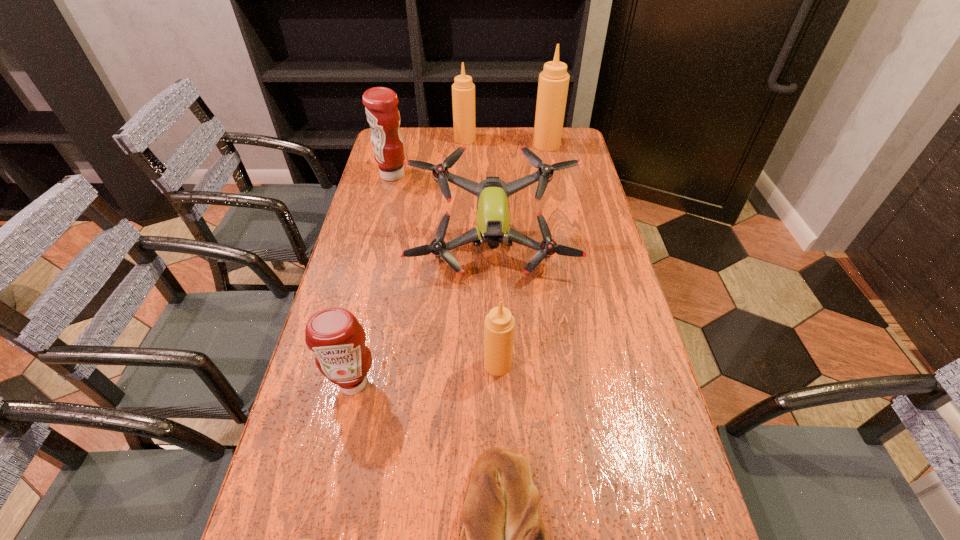
Where is `the tallest object`? the tallest object is located at coordinates (553, 83).

What are the coordinates of `the tallest condiment` in the screenshot? It's located at (553, 83).

At what (x,y) coordinates should I click in order to perform the action: click on the third condiment from left to right. Please return your answer as a coordinate pair (x, y). The height and width of the screenshot is (540, 960). Looking at the image, I should click on (463, 90).

The height and width of the screenshot is (540, 960). What are the coordinates of `the second biggest tan condiment` in the screenshot? It's located at (463, 90).

Locate an element on the screen. the sixth nearest object is located at coordinates (382, 113).

This screenshot has height=540, width=960. Find the location of `the bigger red condiment`. the bigger red condiment is located at coordinates (382, 113).

The height and width of the screenshot is (540, 960). I want to click on drone, so pyautogui.click(x=493, y=227).

I want to click on green drone, so click(493, 227).

You are a GUI agent. You are given a task and a screenshot of the screen. Output one action in this format:
    pyautogui.click(x=<x>, y=<y>)
    Task: Click on the smallest tan condiment
    The height and width of the screenshot is (540, 960).
    Given the screenshot: What is the action you would take?
    pyautogui.click(x=499, y=326)

Find the location of `the nearest tan condiment`. the nearest tan condiment is located at coordinates (499, 326).